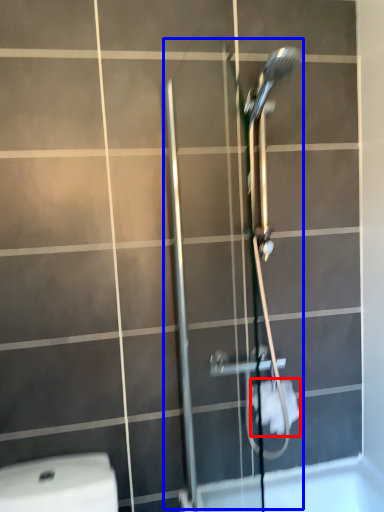
Question: Which point is further to the camera, toilet paper (highlighted by a red box) or shower door (highlighted by a blue box)?

Choices:
 (A) toilet paper
 (B) shower door

Answer: (A)